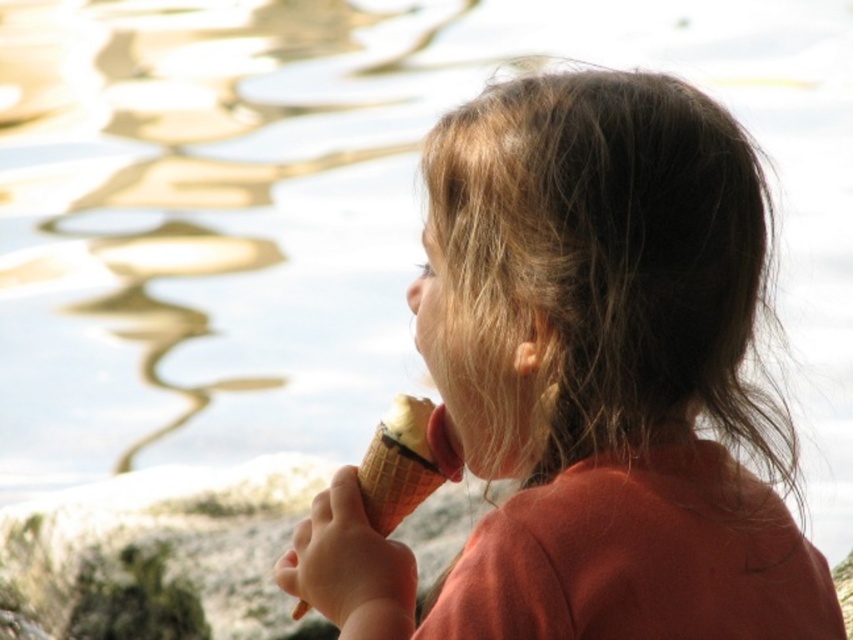
Question: Does matte brown ice cream cone at center have a lesser width compared to vanilla ice cream in waffle cone at lower center?

Choices:
 (A) no
 (B) yes

Answer: (A)

Question: Which point appears closest to the camera in this image?

Choices:
 (A) (280, 477)
 (B) (413, 563)

Answer: (B)

Question: Is the position of smooth gray rock at lower left less distant than that of vanilla ice cream in waffle cone at lower center?

Choices:
 (A) yes
 (B) no

Answer: (B)

Question: Can you confirm if matte brown ice cream cone at center is smaller than smooth gray rock at lower left?

Choices:
 (A) no
 (B) yes

Answer: (B)

Question: Estimate the real-world distances between objects in this image. Which object is closer to the smooth gray rock at lower left?

Choices:
 (A) matte brown ice cream cone at center
 (B) vanilla ice cream in waffle cone at lower center

Answer: (A)

Question: Which is farther from the smooth gray rock at lower left?

Choices:
 (A) vanilla ice cream in waffle cone at lower center
 (B) matte brown ice cream cone at center

Answer: (A)